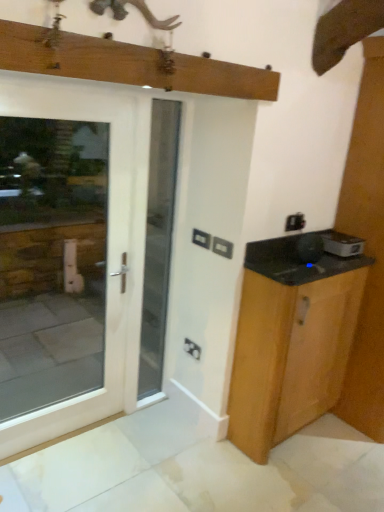
Locate an element on the screen. This screenshot has height=512, width=384. free point above wooden cabinet at right (from a real-world perspective) is located at coordinates (311, 265).